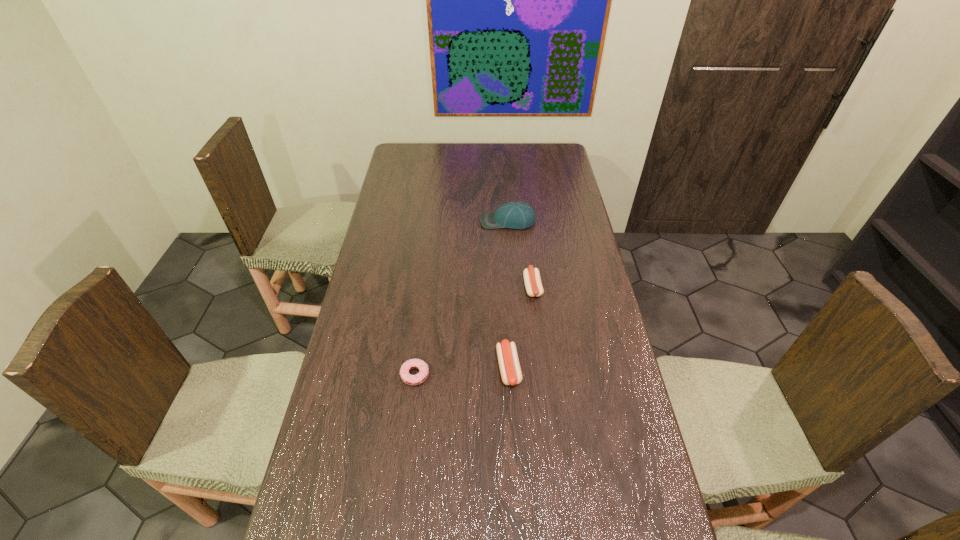
I want to click on free spot between the baseball cap and the leftmost object, so click(x=462, y=298).

Point out which object is positioned as the second nearest to the farther sausage. Please provide its 2D coordinates. Your answer should be formatted as a tuple, i.e. [(x, y)], where the tuple contains the x and y coordinates of a point satisfying the conditions above.

[(516, 215)]

At what (x,y) coordinates should I click in order to perform the action: click on object that is the nearest to the second farthest object. Please return your answer as a coordinate pair (x, y). Looking at the image, I should click on (509, 365).

Select which sausage appears as the second closest to the farthest object. Please provide its 2D coordinates. Your answer should be formatted as a tuple, i.e. [(x, y)], where the tuple contains the x and y coordinates of a point satisfying the conditions above.

[(509, 365)]

Locate an element on the screen. Image resolution: width=960 pixels, height=540 pixels. sausage that stands as the second closest to the tallest object is located at coordinates (509, 365).

Locate an element on the screen. The image size is (960, 540). free space that satisfies the following two spatial constraints: 1. on the back side of the farther sausage; 2. on the right side of the shortest object is located at coordinates (425, 287).